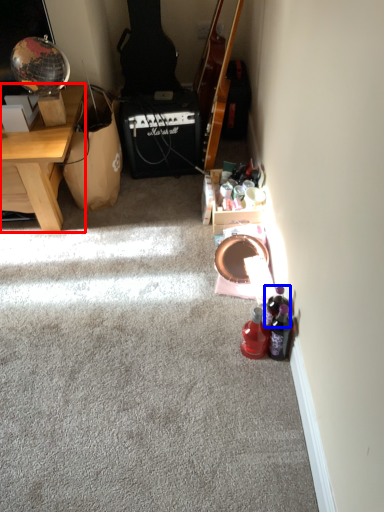
Question: Which of the following is the closest to the observer, desk (highlighted by a red box) or bottle (highlighted by a blue box)?

Choices:
 (A) desk
 (B) bottle

Answer: (B)